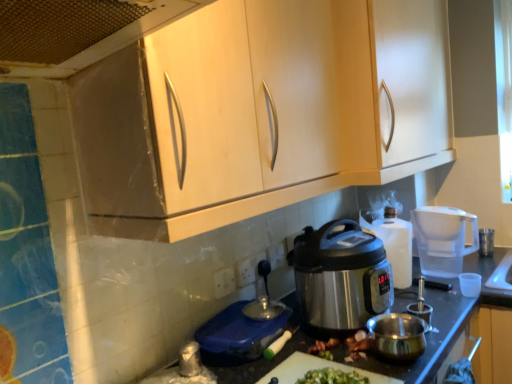
Question: Is transparent plastic water filter at right taller than metallic mesh at upper left?

Choices:
 (A) no
 (B) yes

Answer: (B)

Question: Can you confirm if transparent plastic water filter at right is positioned to the right of metallic mesh at upper left?

Choices:
 (A) no
 (B) yes

Answer: (B)

Question: Would you say metallic mesh at upper left is part of transparent plastic water filter at right's contents?

Choices:
 (A) no
 (B) yes

Answer: (A)

Question: Is transparent plastic water filter at right positioned with its back to metallic mesh at upper left?

Choices:
 (A) no
 (B) yes

Answer: (A)

Question: Is transparent plastic water filter at right closer to camera compared to metallic mesh at upper left?

Choices:
 (A) no
 (B) yes

Answer: (A)

Question: Is transparent plastic water filter at right aimed at metallic mesh at upper left?

Choices:
 (A) no
 (B) yes

Answer: (A)

Question: Can you confirm if matte wood cabinets at upper center, placed as the 1th cabinetry when sorted from front to back, is wider than white plastic power outlet at center, arranged as the third power outlet when viewed from the back?

Choices:
 (A) yes
 (B) no

Answer: (A)

Question: Is matte wood cabinets at upper center, which is counted as the 2th cabinetry, starting from the back, oriented away from white plastic power outlet at center, arranged as the third power outlet when viewed from the back?

Choices:
 (A) yes
 (B) no

Answer: (B)

Question: Can you confirm if matte wood cabinets at upper center, which is counted as the 2th cabinetry, starting from the back, is bigger than white plastic power outlet at center, arranged as the third power outlet when viewed from the back?

Choices:
 (A) no
 (B) yes

Answer: (B)

Question: Is the depth of matte wood cabinets at upper center, which is counted as the 2th cabinetry, starting from the back, greater than that of white plastic power outlet at center, which ranks as the 1th power outlet in front-to-back order?

Choices:
 (A) no
 (B) yes

Answer: (A)

Question: From the image's perspective, does matte wood cabinets at upper center, which is counted as the 2th cabinetry, starting from the back, appear lower than white plastic power outlet at center, which ranks as the 1th power outlet in front-to-back order?

Choices:
 (A) no
 (B) yes

Answer: (A)

Question: Is matte wood cabinets at upper center, placed as the 1th cabinetry when sorted from front to back, taller than white plastic power outlet at center, arranged as the third power outlet when viewed from the back?

Choices:
 (A) yes
 (B) no

Answer: (A)

Question: Is white plastic power outlet at center, the third power outlet in the front-to-back sequence, completely or partially inside white plastic power outlet at center, the 3th power outlet from the right?

Choices:
 (A) yes
 (B) no

Answer: (B)